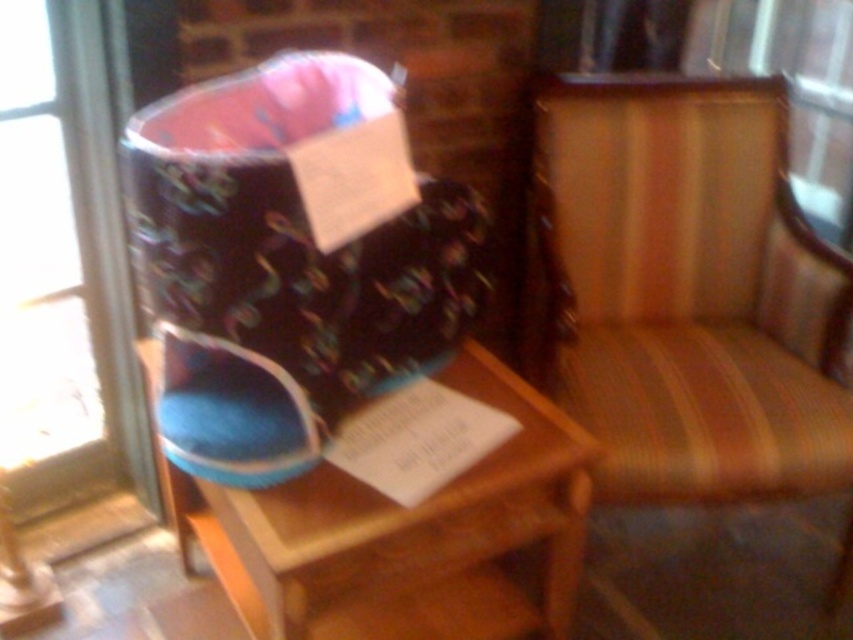
Does point (741, 301) lie behind point (340, 636)?

Yes, point (741, 301) is farther from viewer.

Is the position of striped fabric armchair at center less distant than that of blue fabric stool at center?

No, striped fabric armchair at center is further to the viewer.

At what (x,y) coordinates should I click in order to perform the action: click on striped fabric armchair at center. Please return your answer as a coordinate pair (x, y). The image size is (853, 640). Looking at the image, I should click on (685, 291).

Who is positioned more to the right, velvet fabric boot at center or blue fabric stool at center?

blue fabric stool at center

Who is lower down, velvet fabric boot at center or blue fabric stool at center?

blue fabric stool at center is below.

Image resolution: width=853 pixels, height=640 pixels. Describe the element at coordinates (283, 268) in the screenshot. I see `velvet fabric boot at center` at that location.

I want to click on velvet fabric boot at center, so click(x=283, y=268).

Who is more forward, (647,284) or (260,330)?

Point (260,330) is in front.

Where is `striped fabric armchair at center`? This screenshot has height=640, width=853. striped fabric armchair at center is located at coordinates (685, 291).